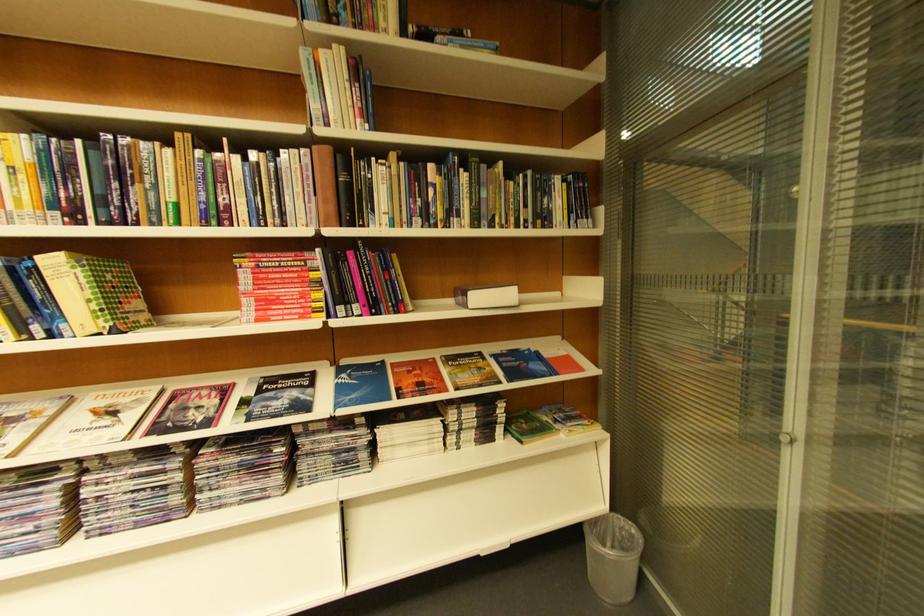
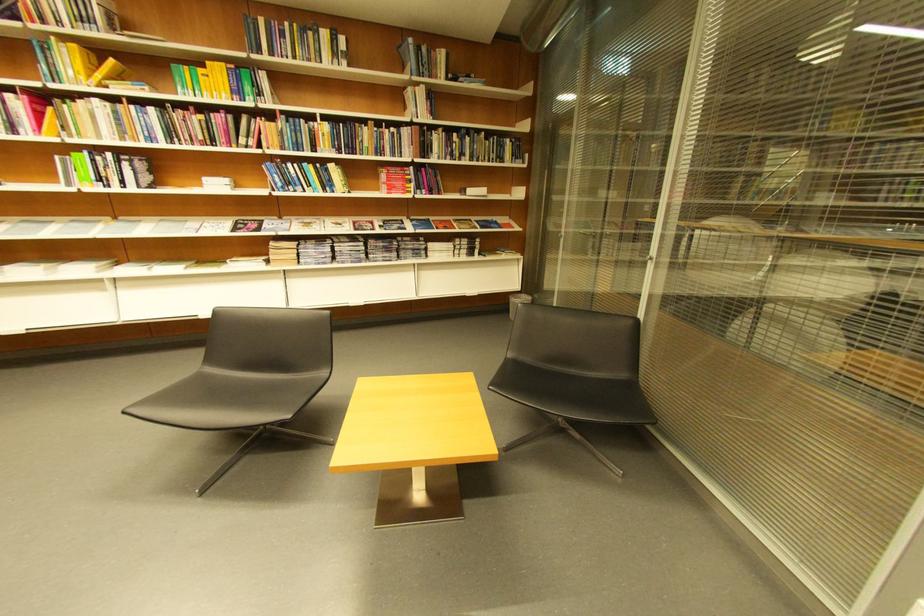
Locate, in the second image, the point that corresponds to (x=263, y=156) in the first image.

(403, 131)